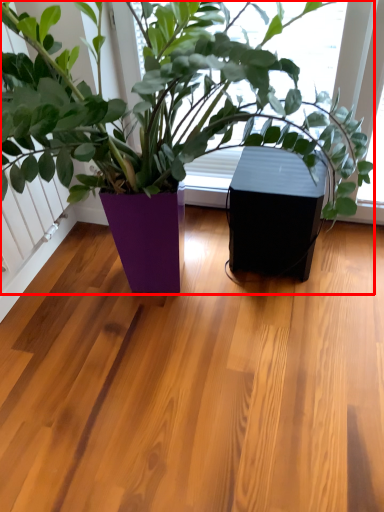
Question: From the image's perspective, what is the correct spatial positioning of houseplant (annotated by the red box) in reference to window box?

Choices:
 (A) above
 (B) below

Answer: (A)